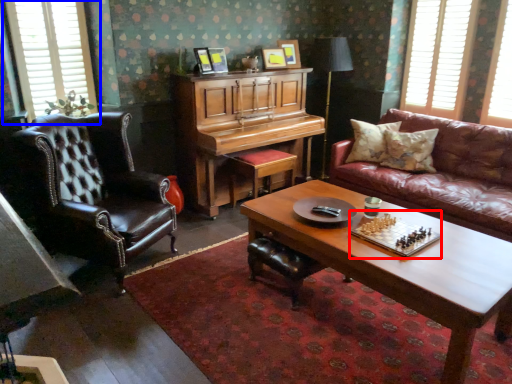
Question: Which of the following is the closest to the observer, board game (highlighted by a red box) or window (highlighted by a blue box)?

Choices:
 (A) board game
 (B) window

Answer: (A)